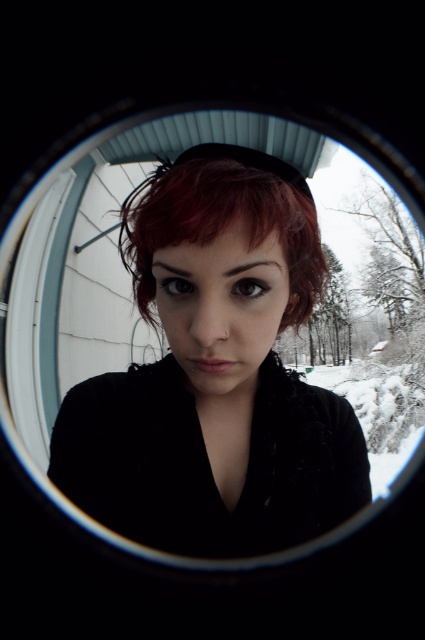
Is matte black hair at center taller than dark red hair at center?

Indeed, matte black hair at center has a greater height compared to dark red hair at center.

Describe the element at coordinates (215, 372) in the screenshot. The image size is (425, 640). I see `matte black hair at center` at that location.

Identify the location of matte black hair at center. The height and width of the screenshot is (640, 425). click(x=215, y=372).